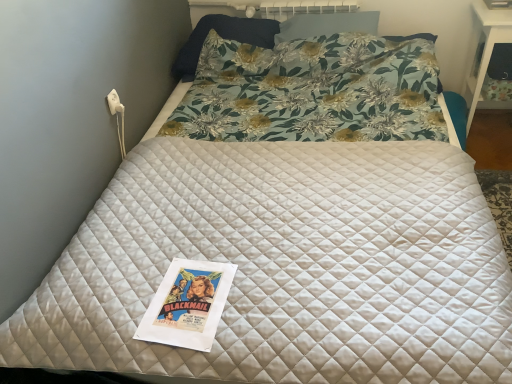
Question: Considering the relative positions of floral fabric pillow at upper center, positioned as the second pillow in right-to-left order, and white glossy table at upper right in the image provided, is floral fabric pillow at upper center, positioned as the second pillow in right-to-left order, to the right of white glossy table at upper right from the viewer's perspective?

Choices:
 (A) yes
 (B) no

Answer: (B)

Question: From a real-world perspective, does floral fabric pillow at upper center, positioned as the second pillow in right-to-left order, sit lower than white glossy table at upper right?

Choices:
 (A) yes
 (B) no

Answer: (B)

Question: Is floral fabric pillow at upper center, the first pillow positioned from the left, not inside white glossy table at upper right?

Choices:
 (A) yes
 (B) no

Answer: (A)

Question: Is floral fabric pillow at upper center, the first pillow positioned from the left, positioned with its back to white glossy table at upper right?

Choices:
 (A) no
 (B) yes

Answer: (A)

Question: Is floral fabric pillow at upper center, the first pillow positioned from the left, in contact with white glossy table at upper right?

Choices:
 (A) yes
 (B) no

Answer: (B)

Question: From a real-world perspective, is white glossy table at upper right above or below floral fabric pillow at upper center, the first pillow positioned from the left?

Choices:
 (A) below
 (B) above

Answer: (A)

Question: Considering the positions of point (480, 48) and point (264, 21), is point (480, 48) closer or farther from the camera than point (264, 21)?

Choices:
 (A) farther
 (B) closer

Answer: (B)

Question: From the image's perspective, relative to floral fabric pillow at upper center, the first pillow positioned from the left, is white glossy table at upper right above or below?

Choices:
 (A) above
 (B) below

Answer: (B)

Question: Considering the positions of white glossy table at upper right and floral fabric pillow at upper center, positioned as the second pillow in right-to-left order, in the image, is white glossy table at upper right taller or shorter than floral fabric pillow at upper center, positioned as the second pillow in right-to-left order,?

Choices:
 (A) tall
 (B) short

Answer: (A)

Question: Does point (481, 11) appear closer or farther from the camera than point (349, 23)?

Choices:
 (A) farther
 (B) closer

Answer: (A)

Question: Considering the relative positions of white glossy table at upper right and floral fabric pillow at upper center, which is the 1th pillow in right-to-left order, in the image provided, is white glossy table at upper right to the left or to the right of floral fabric pillow at upper center, which is the 1th pillow in right-to-left order,?

Choices:
 (A) right
 (B) left

Answer: (A)

Question: From a real-world perspective, is white glossy table at upper right positioned above or below floral fabric pillow at upper center, which appears as the second pillow when viewed from the left?

Choices:
 (A) below
 (B) above

Answer: (A)

Question: Considering the positions of white glossy table at upper right and floral fabric pillow at upper center, which appears as the second pillow when viewed from the left, in the image, is white glossy table at upper right bigger or smaller than floral fabric pillow at upper center, which appears as the second pillow when viewed from the left,?

Choices:
 (A) small
 (B) big

Answer: (B)

Question: Based on their positions, is floral fabric pillow at upper center, the first pillow positioned from the left, located to the left or right of floral fabric pillow at upper center, which is the 1th pillow in right-to-left order?

Choices:
 (A) right
 (B) left

Answer: (B)

Question: Is point (181, 64) closer or farther from the camera than point (308, 33)?

Choices:
 (A) closer
 (B) farther

Answer: (B)